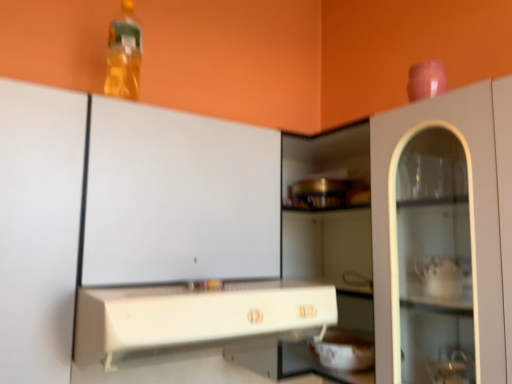
Where is `white glossy bowl at lower center`? The image size is (512, 384). white glossy bowl at lower center is located at coordinates (345, 350).

Image resolution: width=512 pixels, height=384 pixels. What do you see at coordinates (345, 350) in the screenshot?
I see `white glossy bowl at lower center` at bounding box center [345, 350].

I want to click on translucent plastic bottle at upper left, so click(124, 55).

Identify the location of white glossy bowl at lower center. This screenshot has width=512, height=384. (345, 350).

Between point (331, 365) and point (128, 307), which one is positioned behind?

Point (331, 365)

Which of these two, white glossy bowl at lower center or white plastic countertop at center, stands shorter?

Standing shorter between the two is white glossy bowl at lower center.

Considering the relative sizes of white glossy bowl at lower center and white plastic countertop at center in the image provided, is white glossy bowl at lower center smaller than white plastic countertop at center?

Yes.

Is white glossy bowl at lower center oriented towards translucent plastic bottle at upper left?

No, white glossy bowl at lower center is not oriented towards translucent plastic bottle at upper left.

From a real-world perspective, between white glossy bowl at lower center and translucent plastic bottle at upper left, who is vertically lower?

white glossy bowl at lower center is physically lower.

What are the coordinates of `appliance lying on the right of translucent plastic bottle at upper left` in the screenshot? It's located at (345, 350).

Looking at this image, considering the positions of objects white glossy bowl at lower center and translucent plastic bottle at upper left in the image provided, who is more to the left, white glossy bowl at lower center or translucent plastic bottle at upper left?

translucent plastic bottle at upper left.

From the image's perspective, which one is positioned higher, translucent plastic bottle at upper left or white glossy bowl at lower center?

translucent plastic bottle at upper left, from the image's perspective.

Does point (133, 90) appear closer or farther from the camera than point (353, 334)?

Point (133, 90) is closer to the camera than point (353, 334).

How different are the orientations of translucent plastic bottle at upper left and white glossy bowl at lower center in degrees?

87.8 degrees separate the facing orientations of translucent plastic bottle at upper left and white glossy bowl at lower center.

In the scene shown: In terms of size, does translucent plastic bottle at upper left appear bigger or smaller than white glossy bowl at lower center?

Clearly, translucent plastic bottle at upper left is larger in size than white glossy bowl at lower center.

Based on the photo, which is nearer, (x=135, y=87) or (x=186, y=349)?

The point (x=186, y=349) is in front.

Identify the location of bottle behind the white plastic countertop at center. The width and height of the screenshot is (512, 384). (124, 55).

How many degrees apart are the facing directions of translucent plastic bottle at upper left and white plastic countertop at center?

The angle between the facing direction of translucent plastic bottle at upper left and the facing direction of white plastic countertop at center is 0.205 degrees.

Is translucent plastic bottle at upper left turned away from white plastic countertop at center?

No, white plastic countertop at center is not at the back of translucent plastic bottle at upper left.

From the image's perspective, which object appears higher, white plastic countertop at center or translucent plastic bottle at upper left?

translucent plastic bottle at upper left appears higher in the image.

Between white plastic countertop at center and translucent plastic bottle at upper left, which one has larger width?

white plastic countertop at center is wider.

Considering the relative positions of white plastic countertop at center and translucent plastic bottle at upper left in the image provided, is white plastic countertop at center to the left of translucent plastic bottle at upper left from the viewer's perspective?

Incorrect, white plastic countertop at center is not on the left side of translucent plastic bottle at upper left.

Is white plastic countertop at center positioned before translucent plastic bottle at upper left?

Yes, it is.

In terms of height, does white plastic countertop at center look taller or shorter compared to white glossy bowl at lower center?

Clearly, white plastic countertop at center is taller compared to white glossy bowl at lower center.

From the picture: From a real-world perspective, relative to white glossy bowl at lower center, is white plastic countertop at center vertically above or below?

In terms of real-world spatial position, white plastic countertop at center is above white glossy bowl at lower center.

Does white plastic countertop at center have a smaller size compared to white glossy bowl at lower center?

Incorrect, white plastic countertop at center is not smaller in size than white glossy bowl at lower center.

Does white plastic countertop at center have a lesser width compared to white glossy bowl at lower center?

No.

This screenshot has height=384, width=512. What are the coordinates of `appliance behind the white plastic countertop at center` in the screenshot? It's located at (345, 350).

Identify the location of appliance lying below the translucent plastic bottle at upper left (from the image's perspective). The image size is (512, 384). tap(345, 350).

Considering their positions, is translucent plastic bottle at upper left positioned closer to white plastic countertop at center than white glossy bowl at lower center?

white glossy bowl at lower center.

Considering their positions, is white glossy bowl at lower center positioned closer to white plastic countertop at center than translucent plastic bottle at upper left?

white glossy bowl at lower center.

Which object lies nearer to the anchor point white glossy bowl at lower center, white plastic countertop at center or translucent plastic bottle at upper left?

white plastic countertop at center is closer to white glossy bowl at lower center.

Considering their positions, is translucent plastic bottle at upper left positioned closer to white glossy bowl at lower center than white plastic countertop at center?

white plastic countertop at center.

Based on their spatial positions, is white glossy bowl at lower center or white plastic countertop at center further from translucent plastic bottle at upper left?

Based on the image, white glossy bowl at lower center appears to be further to translucent plastic bottle at upper left.

Considering their positions, is white plastic countertop at center positioned further to translucent plastic bottle at upper left than white glossy bowl at lower center?

white glossy bowl at lower center is further to translucent plastic bottle at upper left.

This screenshot has width=512, height=384. I want to click on countertop that lies between translucent plastic bottle at upper left and white glossy bowl at lower center from top to bottom, so click(195, 319).